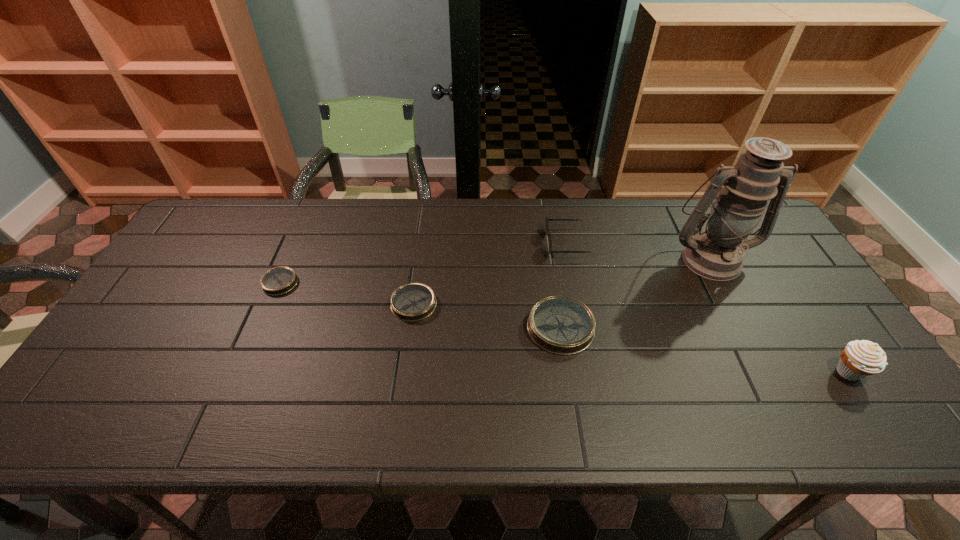
Find the location of `the rightmost object`. the rightmost object is located at coordinates (859, 359).

You are a GUI agent. You are given a task and a screenshot of the screen. Output one action in this format:
    pyautogui.click(x=<x>, y=<y>)
    Task: Click on the vacant space located on the right of the shortest object
    
    Given the screenshot: What is the action you would take?
    pyautogui.click(x=336, y=283)

Where is `free space located 0.220m on the right of the second compass from right to left`? The image size is (960, 540). free space located 0.220m on the right of the second compass from right to left is located at coordinates (517, 304).

Find the location of a particular element. This screenshot has width=960, height=540. vacant space situated 0.220m on the back of the rightmost compass is located at coordinates (548, 248).

At what (x,y) coordinates should I click in order to perform the action: click on free space located on the front-facing side of the third tallest object. Please return your answer as a coordinate pair (x, y). Looking at the image, I should click on (470, 243).

At what (x,y) coordinates should I click in order to perform the action: click on vacant region located 0.070m on the front-facing side of the third tallest object. Please return your answer as a coordinate pair (x, y). This screenshot has height=540, width=960. Looking at the image, I should click on (524, 243).

The image size is (960, 540). I want to click on vacant space located on the front-facing side of the third tallest object, so click(x=531, y=243).

I want to click on free space located 0.120m on the back of the oil lamp, so click(687, 215).

This screenshot has height=540, width=960. I want to click on vacant space located on the left of the nearest object, so click(781, 373).

Identify the location of sunglasses located at the far edge. The image size is (960, 540). (547, 219).